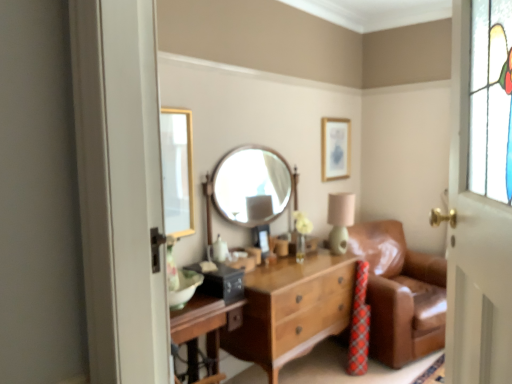
Question: From a real-world perspective, is wooden round mirror at center over matte green table lamp at center?

Choices:
 (A) yes
 (B) no

Answer: (A)

Question: Does wooden round mirror at center come in front of matte green table lamp at center?

Choices:
 (A) yes
 (B) no

Answer: (A)

Question: Is wooden round mirror at center touching matte green table lamp at center?

Choices:
 (A) yes
 (B) no

Answer: (B)

Question: Is wooden round mirror at center oriented away from matte green table lamp at center?

Choices:
 (A) yes
 (B) no

Answer: (B)

Question: Can you confirm if wooden round mirror at center is bigger than matte green table lamp at center?

Choices:
 (A) no
 (B) yes

Answer: (B)

Question: Is wooden chest of drawers at center to the left or to the right of wooden round mirror at center in the image?

Choices:
 (A) left
 (B) right

Answer: (B)

Question: Is point (352, 269) positioned closer to the camera than point (272, 203)?

Choices:
 (A) closer
 (B) farther

Answer: (A)

Question: From a real-world perspective, is wooden chest of drawers at center physically located above or below wooden round mirror at center?

Choices:
 (A) below
 (B) above

Answer: (A)

Question: Is wooden chest of drawers at center taller or shorter than wooden round mirror at center?

Choices:
 (A) short
 (B) tall

Answer: (B)

Question: Is gold metallic picture frame at upper center bigger or smaller than wooden chest of drawers at center?

Choices:
 (A) small
 (B) big

Answer: (A)

Question: From a real-world perspective, relative to wooden chest of drawers at center, is gold metallic picture frame at upper center vertically above or below?

Choices:
 (A) below
 (B) above

Answer: (B)

Question: Considering their positions, is gold metallic picture frame at upper center located in front of or behind wooden chest of drawers at center?

Choices:
 (A) behind
 (B) front

Answer: (A)

Question: In the image, is gold metallic picture frame at upper center on the left side or the right side of wooden chest of drawers at center?

Choices:
 (A) right
 (B) left

Answer: (A)

Question: From the image's perspective, is wooden round mirror at center positioned above or below gold metallic picture frame at upper center?

Choices:
 (A) below
 (B) above

Answer: (A)

Question: From a real-world perspective, is wooden round mirror at center above or below gold metallic picture frame at upper center?

Choices:
 (A) above
 (B) below

Answer: (B)